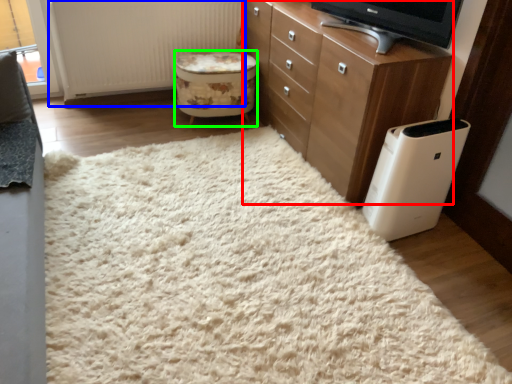
Question: Which is farther away from chest of drawers (highlighted by a red box)? radiator (highlighted by a blue box) or stool (highlighted by a green box)?

Choices:
 (A) radiator
 (B) stool

Answer: (A)